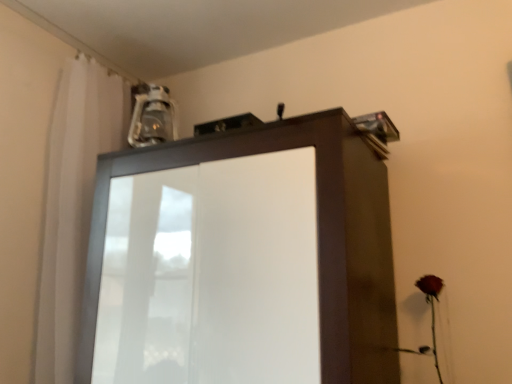
Question: Considering the relative positions of matte red rose at lower right and matte brown cupboard at upper center in the image provided, is matte red rose at lower right to the right of matte brown cupboard at upper center from the viewer's perspective?

Choices:
 (A) yes
 (B) no

Answer: (A)

Question: Is matte red rose at lower right bigger than matte brown cupboard at upper center?

Choices:
 (A) no
 (B) yes

Answer: (A)

Question: Would you say matte red rose at lower right is outside matte brown cupboard at upper center?

Choices:
 (A) yes
 (B) no

Answer: (A)

Question: Is matte red rose at lower right oriented away from matte brown cupboard at upper center?

Choices:
 (A) yes
 (B) no

Answer: (B)

Question: Is matte red rose at lower right with matte brown cupboard at upper center?

Choices:
 (A) no
 (B) yes

Answer: (A)

Question: Can you confirm if matte red rose at lower right is thinner than matte brown cupboard at upper center?

Choices:
 (A) yes
 (B) no

Answer: (A)

Question: Is matte red rose at lower right outside white sheer curtain at upper left?

Choices:
 (A) yes
 (B) no

Answer: (A)

Question: Is there a large distance between matte red rose at lower right and white sheer curtain at upper left?

Choices:
 (A) yes
 (B) no

Answer: (A)

Question: Considering the relative positions of matte red rose at lower right and white sheer curtain at upper left in the image provided, is matte red rose at lower right to the right of white sheer curtain at upper left from the viewer's perspective?

Choices:
 (A) no
 (B) yes

Answer: (B)

Question: From a real-world perspective, is matte red rose at lower right located beneath white sheer curtain at upper left?

Choices:
 (A) no
 (B) yes

Answer: (B)

Question: Is matte red rose at lower right to the left of white sheer curtain at upper left from the viewer's perspective?

Choices:
 (A) no
 (B) yes

Answer: (A)

Question: Is matte red rose at lower right turned away from white sheer curtain at upper left?

Choices:
 (A) no
 (B) yes

Answer: (A)

Question: From a real-world perspective, is white sheer curtain at upper left on matte red rose at lower right?

Choices:
 (A) yes
 (B) no

Answer: (A)